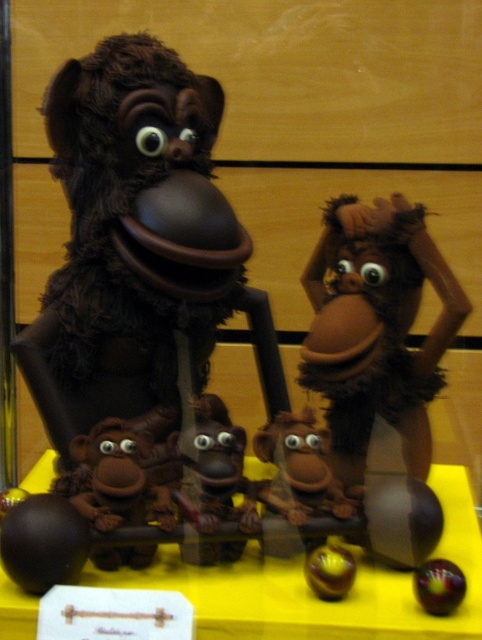
Question: Which point is closer to the camera?

Choices:
 (A) fuzzy brown puppet at center
 (B) yellow matte table at center

Answer: (B)

Question: Which point appears farthest from the camera in this image?

Choices:
 (A) (112, 204)
 (B) (361, 600)

Answer: (A)

Question: Is yellow matte table at center wider than shiny purple ball at center?

Choices:
 (A) no
 (B) yes

Answer: (B)

Question: Estimate the real-world distances between objects in this image. Which object is farther from the yellow matte table at center?

Choices:
 (A) shiny purple ball at center
 (B) fuzzy brown puppet at center

Answer: (B)

Question: Is fuzzy brown puppet at center closer to the viewer compared to yellow matte table at center?

Choices:
 (A) yes
 (B) no

Answer: (B)

Question: Is fuzzy brown puppet at center below shiny purple ball at center?

Choices:
 (A) no
 (B) yes

Answer: (A)